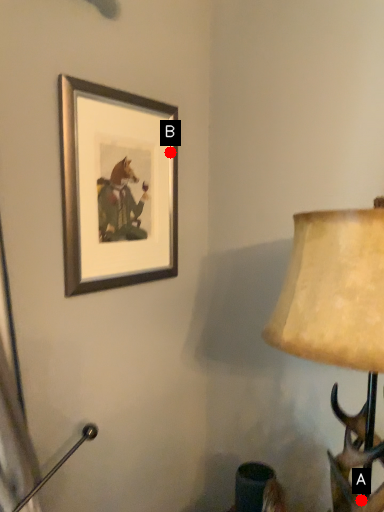
Question: Two points are circled on the image, labeled by A and B beside each circle. Which of the following is the farthest from the observer?

Choices:
 (A) A is further
 (B) B is further

Answer: (B)